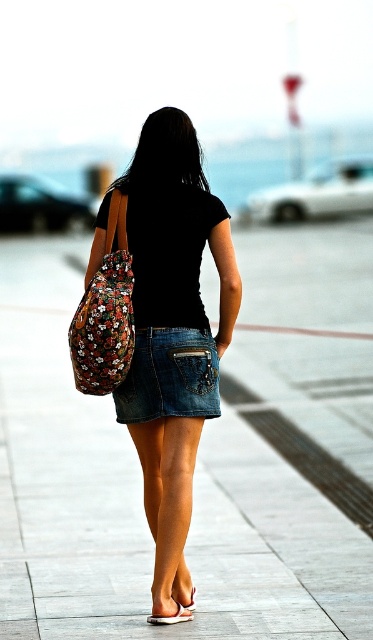
Can you confirm if floral fabric backpack at left is thinner than white matte heel at lower center?

No, floral fabric backpack at left is not thinner than white matte heel at lower center.

Is floral fabric backpack at left positioned behind white matte heel at lower center?

No, floral fabric backpack at left is closer to the viewer.

Between point (110, 259) and point (183, 608), which one is positioned in front?

Point (183, 608) is in front.

The height and width of the screenshot is (640, 373). In order to click on floral fabric backpack at left in this screenshot , I will do `click(105, 312)`.

Looking at this image, can you confirm if floral fabric bag at center is positioned to the right of floral fabric backpack at left?

Indeed, floral fabric bag at center is positioned on the right side of floral fabric backpack at left.

Describe the element at coordinates (173, 332) in the screenshot. The height and width of the screenshot is (640, 373). I see `floral fabric bag at center` at that location.

Who is more forward, (165,339) or (113,301)?

Point (113,301) is more forward.

Locate an element on the screen. floral fabric bag at center is located at coordinates (173, 332).

Who is more forward, [167,308] or [132,410]?

Point [167,308]

Based on the photo, is floral fabric bag at center positioned in front of denim shorts at lower center?

Yes, it is in front of denim shorts at lower center.

Is point (138, 440) farther from viewer compared to point (186, 362)?

Yes, it is.

Locate an element on the screen. floral fabric bag at center is located at coordinates point(173,332).